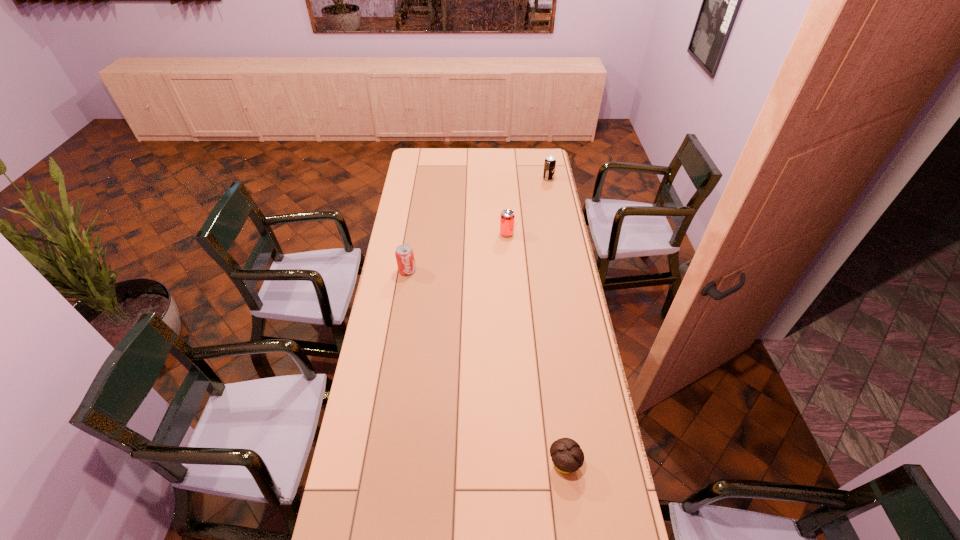
In order to click on free space between the rightmost soda can and the second farthest object in this screenshot , I will do `click(527, 206)`.

The width and height of the screenshot is (960, 540). What are the coordinates of `empty space that is in between the rightmost soda can and the leftmost soda can` in the screenshot? It's located at (478, 225).

Identify the location of vacant point located between the rightmost object and the second soda can from left to right. Image resolution: width=960 pixels, height=540 pixels. (527, 206).

In order to click on vacant space in between the farthest soda can and the third nearest object in this screenshot , I will do `click(527, 206)`.

Where is `empty location between the second farthest object and the nearest soda can`? The image size is (960, 540). empty location between the second farthest object and the nearest soda can is located at coordinates (x=457, y=252).

Choose which object is the third nearest neighbor to the nearest soda can. Please provide its 2D coordinates. Your answer should be formatted as a tuple, i.e. [(x, y)], where the tuple contains the x and y coordinates of a point satisfying the conditions above.

[(550, 163)]

This screenshot has width=960, height=540. Identify the location of object that can be found as the second closest to the second object from left to right. (550, 163).

Locate which soda can ranks in proximity to the shortest object. Please provide its 2D coordinates. Your answer should be formatted as a tuple, i.e. [(x, y)], where the tuple contains the x and y coordinates of a point satisfying the conditions above.

[(404, 253)]

In order to click on soda can that stands as the second closest to the leftmost soda can in this screenshot , I will do `click(550, 163)`.

In order to click on free space in the image that satisfies the following two spatial constraints: 1. on the front side of the muffin; 2. on the left side of the second soda can from left to right in this screenshot , I will do `click(521, 464)`.